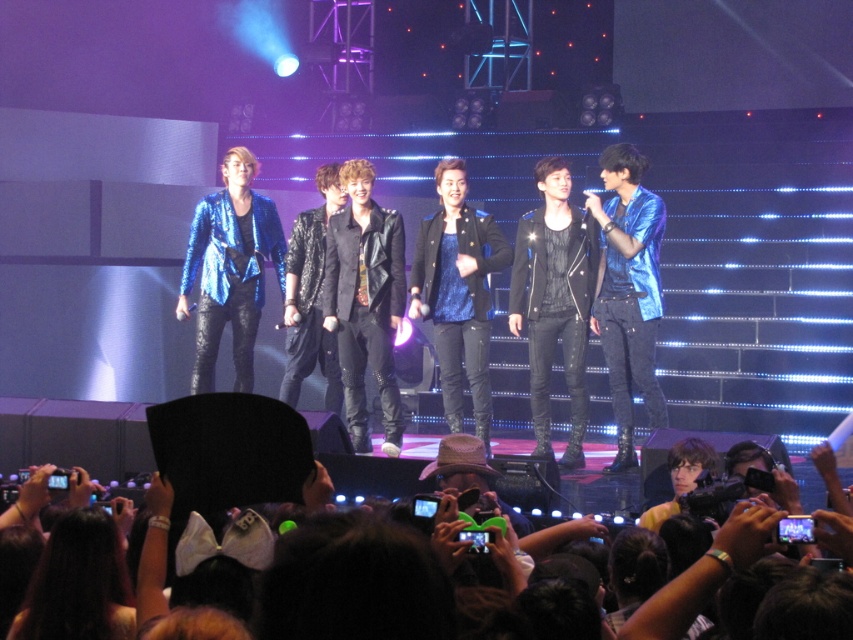
You are a photographer at the concert. You have a camera with a zoom lens that can focus on objects up to 2 meters away. You want to take a photo of the black fabric hat at lower center and the shiny blue jacket at right. Given their sizes, which object should you zoom in more on to ensure both are clearly visible in the photo?

Since the black fabric hat at lower center is smaller than the shiny blue jacket at right, you should zoom in more on the shiny blue jacket at right to ensure both are clearly visible in the photo.

You are a photographer at the concert. You want to take a photo that includes both the shiny metallic jackets at center and the shiny blue jacket at right. Based on their positions, which jacket should be placed on the left side of the photo?

The shiny metallic jackets at center should be placed on the left side of the photo because they are positioned to the left of the shiny blue jacket at right.

You are a photographer at the concert. You want to capture both the shiny metallic jackets at center and the shiny blue jacket at right in the same frame. Which jacket should you focus on to ensure both are visible without zooming in or out?

Since the shiny metallic jackets at center is larger in size than the shiny blue jacket at right, you should focus on the shiny metallic jackets at center to ensure both are visible without adjusting the zoom.